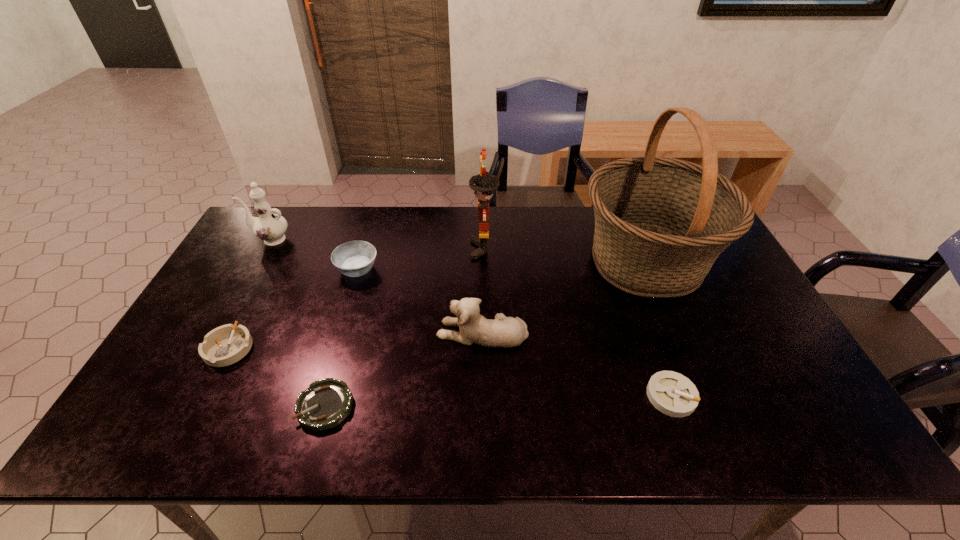
Find the location of a particular element. The image size is (960, 540). vacant region that satisfies the following two spatial constraints: 1. at the spout of the sixth shortest object; 2. on the left side of the tallest ashtray is located at coordinates (253, 269).

Where is `blank area in the image that satisfies the following two spatial constraints: 1. at the spout of the sixth shortest object; 2. on the left side of the shortest ashtray`? The image size is (960, 540). blank area in the image that satisfies the following two spatial constraints: 1. at the spout of the sixth shortest object; 2. on the left side of the shortest ashtray is located at coordinates (178, 406).